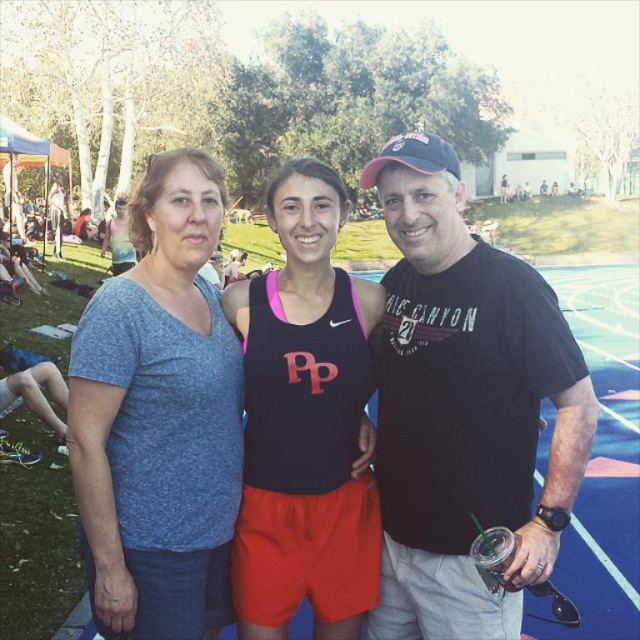
Question: Which point appears farthest from the camera in this image?

Choices:
 (A) (356, 625)
 (B) (163, 627)
 (C) (579, 458)

Answer: (A)

Question: Estimate the real-world distances between objects in this image. Which object is farther from the blue cotton shirt at center?

Choices:
 (A) black matte tank top at center
 (B) black cotton t-shirt at right

Answer: (B)

Question: Does blue cotton shirt at center have a larger size compared to black matte tank top at center?

Choices:
 (A) no
 (B) yes

Answer: (B)

Question: Is black cotton t-shirt at right thinner than black matte tank top at center?

Choices:
 (A) yes
 (B) no

Answer: (B)

Question: Which object appears closest to the camera in this image?

Choices:
 (A) black matte tank top at center
 (B) black cotton t-shirt at right
 (C) blue cotton shirt at center

Answer: (B)

Question: Can you confirm if black cotton t-shirt at right is positioned to the left of black matte tank top at center?

Choices:
 (A) yes
 (B) no

Answer: (B)